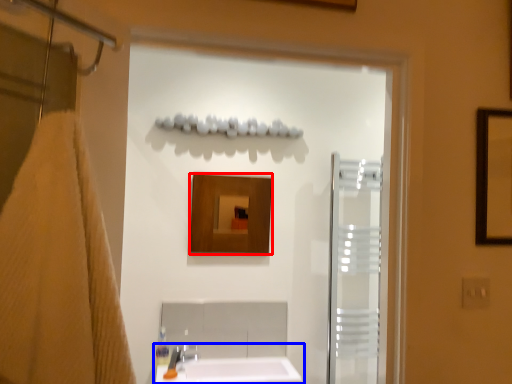
Question: Which object is closer to the camera taking this photo, mirror (highlighted by a red box) or sink (highlighted by a blue box)?

Choices:
 (A) mirror
 (B) sink

Answer: (B)